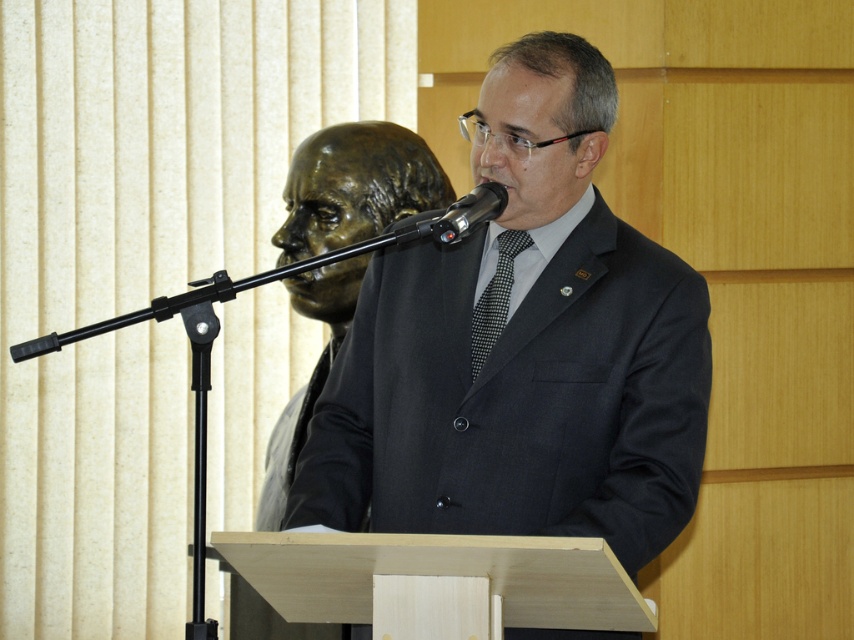
Question: Can you confirm if matte black suit at center is wider than black metallic microphone at center?

Choices:
 (A) yes
 (B) no

Answer: (A)

Question: Is matte black suit at center to the left of black dotted fabric tie at center from the viewer's perspective?

Choices:
 (A) no
 (B) yes

Answer: (A)

Question: Does black dotted fabric tie at center have a larger size compared to black metallic microphone at center?

Choices:
 (A) no
 (B) yes

Answer: (A)

Question: Which of the following is the closest to the observer?

Choices:
 (A) bronze statue at left
 (B) black metallic microphone at center
 (C) black dotted fabric tie at center

Answer: (B)

Question: Which object is positioned farthest from the black metallic microphone at center?

Choices:
 (A) bronze statue at left
 (B) black dotted fabric tie at center
 (C) matte black suit at center

Answer: (A)

Question: Which is farther from the black dotted fabric tie at center?

Choices:
 (A) black metallic microphone at center
 (B) bronze statue at left

Answer: (B)